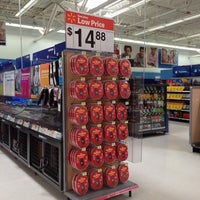
The height and width of the screenshot is (200, 200). In order to click on poster in this screenshot , I will do `click(2, 30)`.